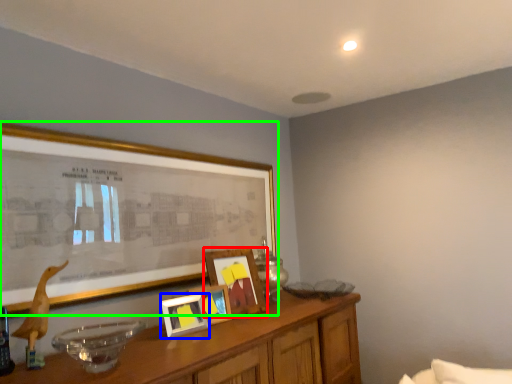
Question: Based on their relative distances, which object is farther from picture frame (highlighted by a red box)? Choose from picture frame (highlighted by a blue box) and picture frame (highlighted by a green box).

Choices:
 (A) picture frame
 (B) picture frame

Answer: (B)